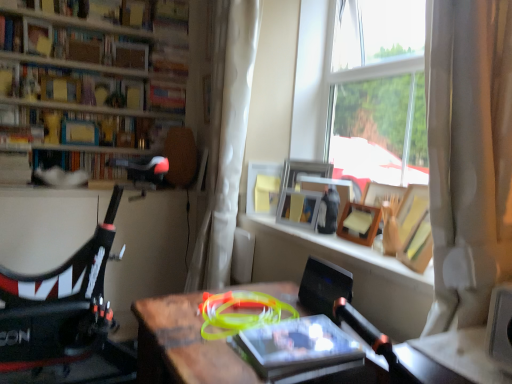
You are a GUI agent. You are given a task and a screenshot of the screen. Output one action in this format:
    pyautogui.click(x=<x>, y=<y>)
    Task: Click on the blank space to the left of wooden picture frame at upper right, which is counted as the third picture frame, starting from the right
    The height and width of the screenshot is (384, 512).
    Given the screenshot: What is the action you would take?
    pyautogui.click(x=271, y=224)